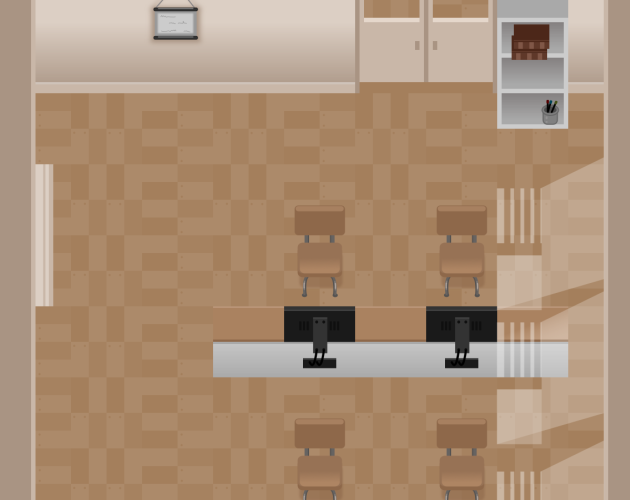
This screenshot has width=630, height=500. What are the coordinates of `computer screen` in the screenshot? It's located at (326, 317), (470, 326).